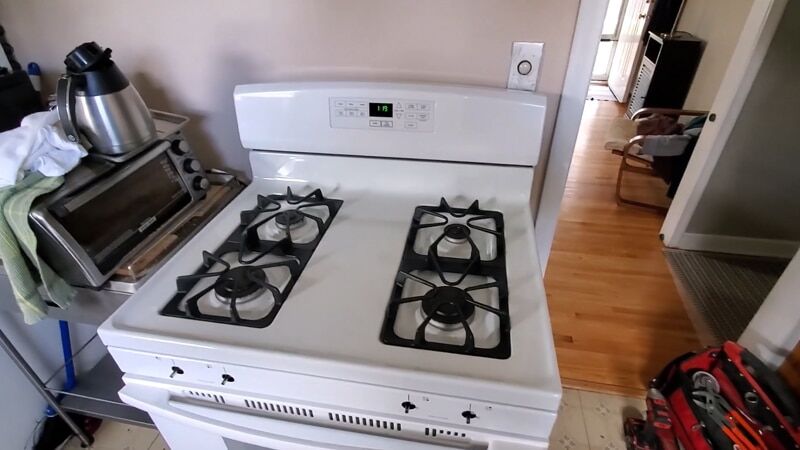
Identify the location of floor. Image resolution: width=800 pixels, height=450 pixels. (648, 316).